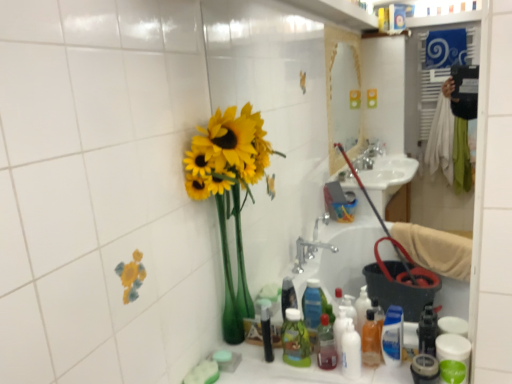
Question: Is white glossy bottle at lower center, arranged as the 2th cleaning product when viewed from the right, positioned in front of green plastic bottle at lower center?

Choices:
 (A) yes
 (B) no

Answer: (A)

Question: From a real-world perspective, does white glossy bottle at lower center, arranged as the 2th cleaning product when viewed from the right, sit lower than green plastic bottle at lower center?

Choices:
 (A) yes
 (B) no

Answer: (A)

Question: Is white glossy bottle at lower center, arranged as the 2th cleaning product when viewed from the right, wider than green plastic bottle at lower center?

Choices:
 (A) no
 (B) yes

Answer: (B)

Question: Can we say white glossy bottle at lower center, arranged as the 2th cleaning product when viewed from the right, lies outside green plastic bottle at lower center?

Choices:
 (A) yes
 (B) no

Answer: (A)

Question: Can green plastic bottle at lower center be found inside white glossy bottle at lower center, arranged as the 2th cleaning product when viewed from the right?

Choices:
 (A) yes
 (B) no

Answer: (B)

Question: Is point (236, 216) positioned closer to the camera than point (331, 331)?

Choices:
 (A) farther
 (B) closer

Answer: (A)

Question: Is yellow matte sunflowers at left taller or shorter than translucent plastic bottle at center, which appears as the second bottle when viewed from the left?

Choices:
 (A) short
 (B) tall

Answer: (B)

Question: From a real-world perspective, is yellow matte sunflowers at left above or below translucent plastic bottle at center, which is counted as the 2th bottle, starting from the right?

Choices:
 (A) above
 (B) below

Answer: (A)

Question: From the image's perspective, is yellow matte sunflowers at left positioned above or below translucent plastic bottle at center, which is counted as the 2th bottle, starting from the right?

Choices:
 (A) above
 (B) below

Answer: (A)

Question: Would you say translucent orange bottle at lower center, which is the 3th bottle in left-to-right order, is inside or outside translucent plastic bottle at center, which is counted as the 2th bottle, starting from the right?

Choices:
 (A) outside
 (B) inside

Answer: (A)

Question: From their relative heights in the image, would you say translucent orange bottle at lower center, which is the first bottle from right to left, is taller or shorter than translucent plastic bottle at center, which is counted as the 2th bottle, starting from the right?

Choices:
 (A) tall
 (B) short

Answer: (A)

Question: Based on their sizes in the image, would you say translucent orange bottle at lower center, which is the first bottle from right to left, is bigger or smaller than translucent plastic bottle at center, which appears as the second bottle when viewed from the left?

Choices:
 (A) big
 (B) small

Answer: (A)

Question: From a real-world perspective, is translucent orange bottle at lower center, which is the 3th bottle in left-to-right order, physically located above or below translucent plastic bottle at center, which appears as the second bottle when viewed from the left?

Choices:
 (A) above
 (B) below

Answer: (A)

Question: Is green plastic bottle at lower center to the left or to the right of blue glossy bottle at lower right, positioned as the second cleaning product in left-to-right order, in the image?

Choices:
 (A) right
 (B) left

Answer: (B)

Question: From a real-world perspective, is green plastic bottle at lower center physically located above or below blue glossy bottle at lower right, acting as the 1th cleaning product starting from the right?

Choices:
 (A) above
 (B) below

Answer: (A)